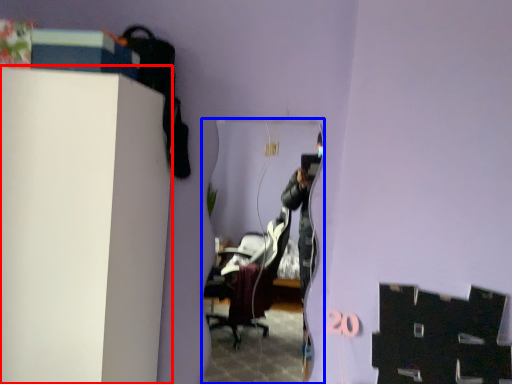
Question: Among these objects, which one is farthest to the camera, furniture (highlighted by a red box) or mirror (highlighted by a blue box)?

Choices:
 (A) furniture
 (B) mirror

Answer: (B)